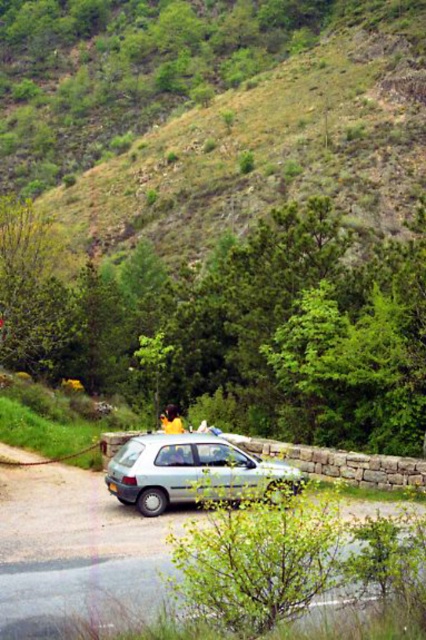
Question: Does green grassy hillside at upper center appear on the left side of light blue metallic hatchback at center?

Choices:
 (A) no
 (B) yes

Answer: (B)

Question: Which of the following is the closest to the observer?

Choices:
 (A) pyautogui.click(x=245, y=138)
 (B) pyautogui.click(x=31, y=484)

Answer: (B)

Question: Does light blue metallic hatchback at center have a greater width compared to yellow fabric at center?

Choices:
 (A) no
 (B) yes

Answer: (B)

Question: Considering the real-world distances, which object is closest to the yellow fabric at center?

Choices:
 (A) metallic silver car at center
 (B) green grassy hillside at upper center

Answer: (A)

Question: Considering the real-world distances, which object is closest to the light blue metallic hatchback at center?

Choices:
 (A) yellow fabric at center
 (B) green grassy hillside at upper center

Answer: (A)

Question: Is green grassy hillside at upper center bigger than light blue metallic hatchback at center?

Choices:
 (A) yes
 (B) no

Answer: (A)